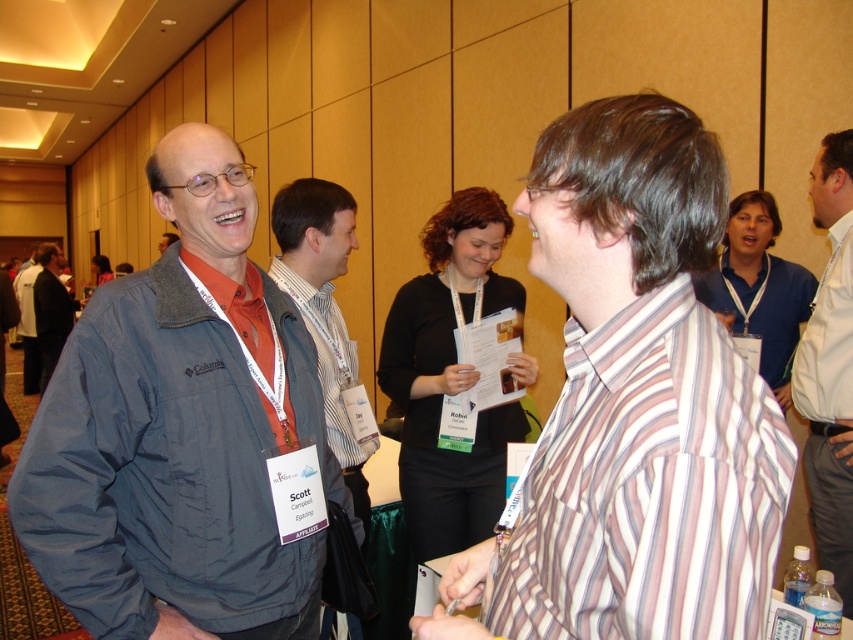
Question: Which of the following is the farthest from the observer?

Choices:
 (A) striped cotton shirt at center
 (B) white shirt at right

Answer: (B)

Question: Can you confirm if striped cotton shirt at center is bigger than dark gray jacket at left?

Choices:
 (A) no
 (B) yes

Answer: (A)

Question: Estimate the real-world distances between objects in this image. Which object is farther from the striped cotton shirt at center?

Choices:
 (A) gray fabric vest at center
 (B) dark blue jacket at left

Answer: (A)

Question: Considering the relative positions of white shirt at right and dark gray jacket at left in the image provided, where is white shirt at right located with respect to dark gray jacket at left?

Choices:
 (A) right
 (B) left

Answer: (A)

Question: Among these objects, which one is farthest from the camera?

Choices:
 (A) gray fabric vest at center
 (B) dark blue jacket at left
 (C) striped cotton shirt at center
 (D) white shirt at right

Answer: (D)

Question: Can you confirm if striped cotton shirt at center is positioned above white shirt at right?

Choices:
 (A) yes
 (B) no

Answer: (A)